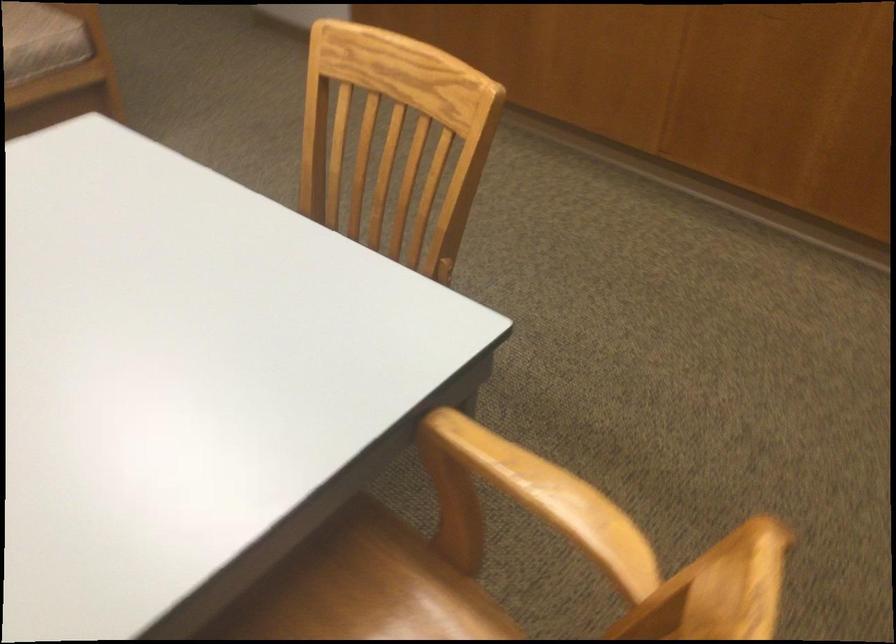
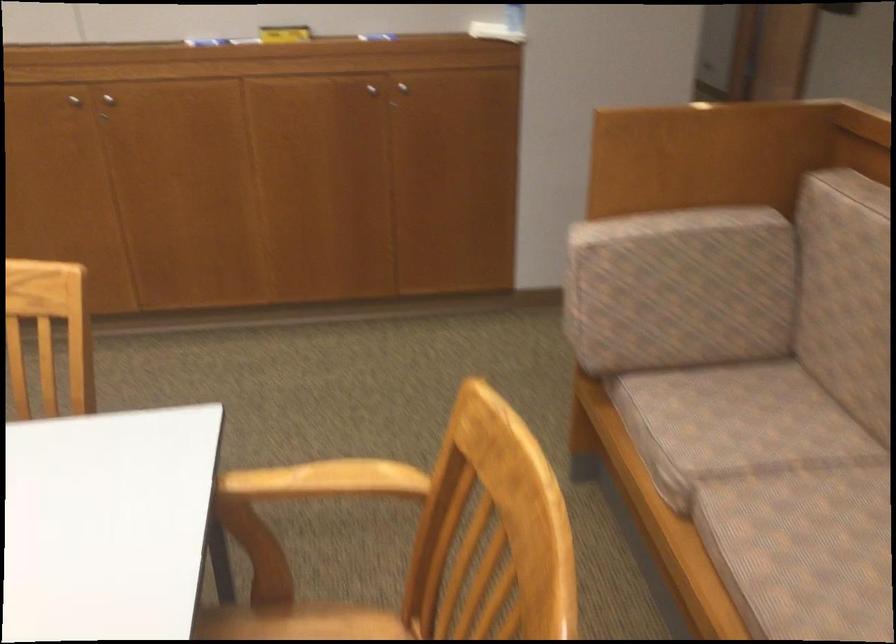
Question: Based on the continuous images, in which direction is the camera rotating? Reply with the corresponding letter.

Choices:
 (A) Left
 (B) Right
 (C) Up
 (D) Down

Answer: (B)